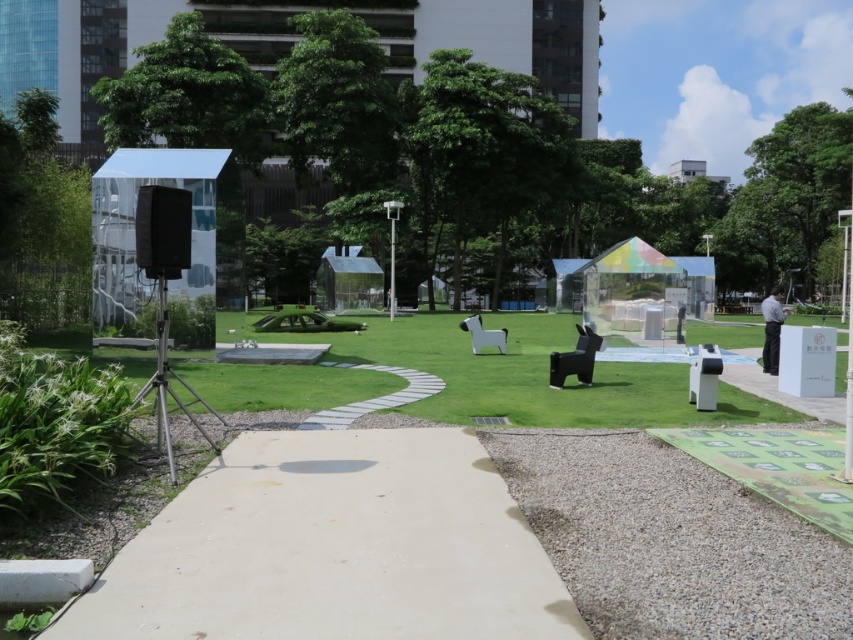
Which is behind, point (293, 604) or point (471, 323)?

Point (471, 323)

This screenshot has height=640, width=853. What are the coordinates of `beige concrete path at center` in the screenshot? It's located at 334,548.

Find the location of a particular element. beige concrete path at center is located at coordinates (334, 548).

Can you confirm if beige concrete path at center is bigger than black matte bench at center?

Incorrect, beige concrete path at center is not larger than black matte bench at center.

Describe the element at coordinates (334, 548) in the screenshot. I see `beige concrete path at center` at that location.

Describe the element at coordinates (334, 548) in the screenshot. The image size is (853, 640). I see `beige concrete path at center` at that location.

I want to click on beige concrete path at center, so click(334, 548).

Does point (549, 406) come closer to viewer compared to point (566, 360)?

Yes, point (549, 406) is closer to viewer.

Does point (332, 348) come farther from viewer compared to point (587, 355)?

Yes, point (332, 348) is farther from viewer.

Identify the location of green grass at center. This screenshot has width=853, height=640. (523, 374).